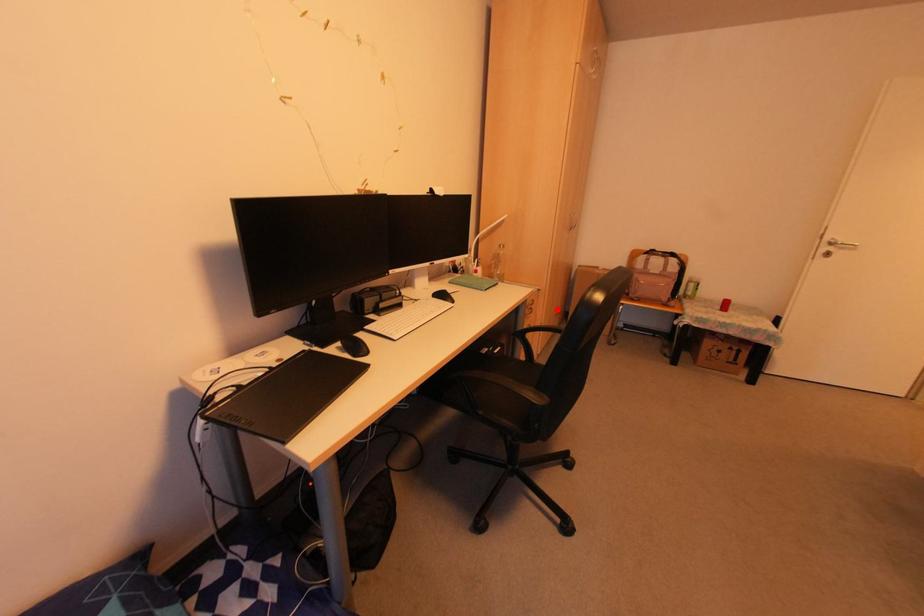
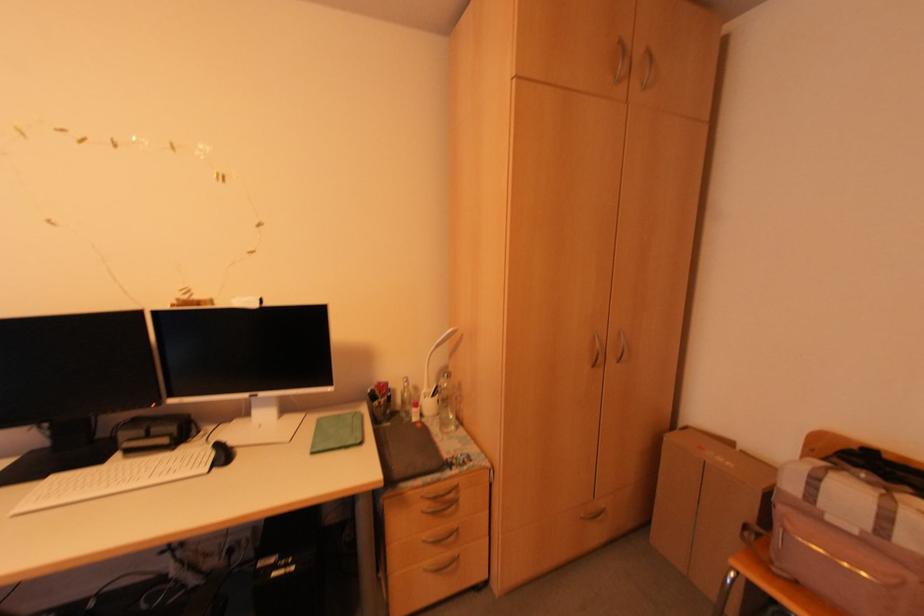
Question: I am providing you with two images of the same scene from different viewpoints. Image1 has a red point marked. In image2, the corresponding 3D location appears at what relative position? Reply with the corresponding letter.

Choices:
 (A) Closer
 (B) Farther

Answer: (A)